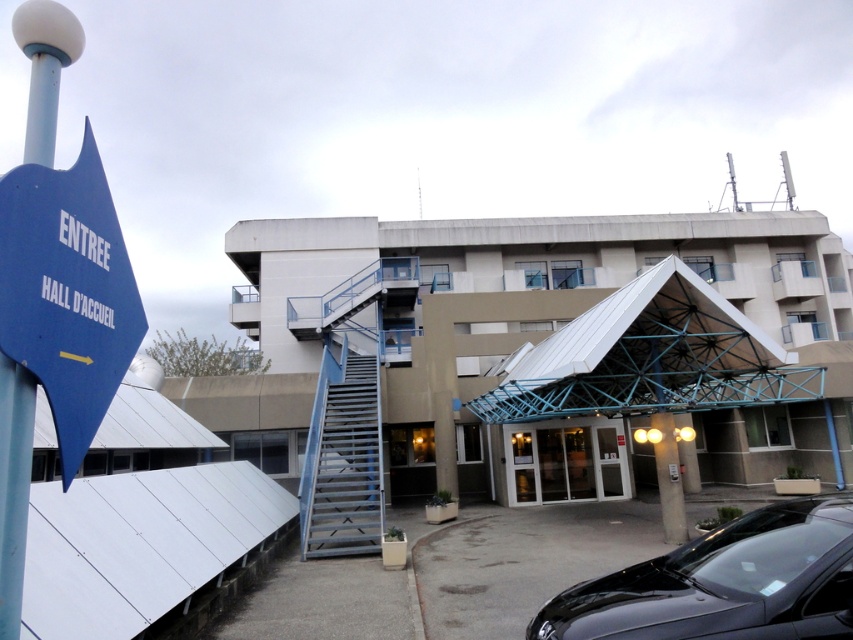
Question: Is blue plastic sign at left below blue plastic signpost at left?

Choices:
 (A) yes
 (B) no

Answer: (B)

Question: Does blue plastic sign at left lie behind white glass doors at center?

Choices:
 (A) yes
 (B) no

Answer: (B)

Question: Does blue plastic sign at left have a smaller size compared to blue plastic signpost at left?

Choices:
 (A) no
 (B) yes

Answer: (A)

Question: Which of the following is the farthest from the observer?

Choices:
 (A) (44, 156)
 (B) (772, 538)

Answer: (B)

Question: Which of the following is the closest to the observer?

Choices:
 (A) (691, 604)
 (B) (538, 476)
 (C) (93, 355)
 (D) (13, 504)

Answer: (D)

Question: Which object is farther from the camera taking this photo?

Choices:
 (A) blue plastic sign at left
 (B) black glossy car at lower right
 (C) white glass doors at center

Answer: (C)